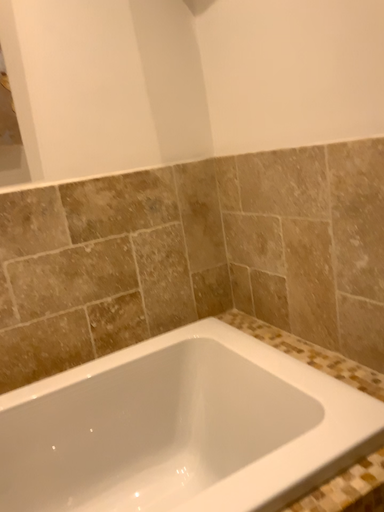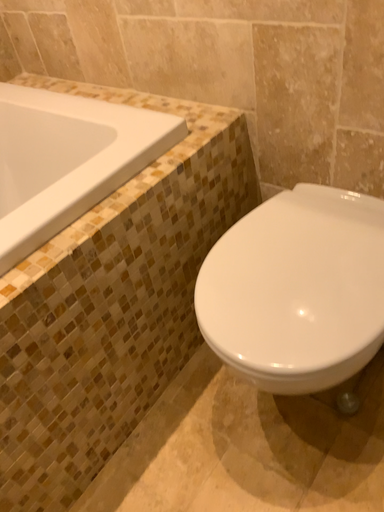
Question: Which way did the camera rotate in the video?

Choices:
 (A) rotated downward
 (B) rotated upward

Answer: (A)